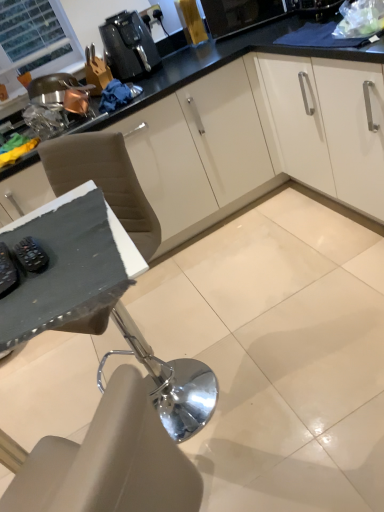
Question: Is black plastic coffee machine at upper center oriented towards black rubber remote control at lower left, the first appliance viewed from the left?

Choices:
 (A) no
 (B) yes

Answer: (A)

Question: Is black plastic coffee machine at upper center closer to the viewer compared to black rubber remote control at lower left, the first appliance viewed from the left?

Choices:
 (A) yes
 (B) no

Answer: (B)

Question: From the image's perspective, would you say black plastic coffee machine at upper center is shown under black rubber remote control at lower left, which appears as the 2th appliance when viewed from the right?

Choices:
 (A) no
 (B) yes

Answer: (A)

Question: From a real-world perspective, does black plastic coffee machine at upper center stand above black rubber remote control at lower left, the first appliance viewed from the left?

Choices:
 (A) no
 (B) yes

Answer: (B)

Question: Is black plastic coffee machine at upper center shorter than black rubber remote control at lower left, the first appliance viewed from the left?

Choices:
 (A) yes
 (B) no

Answer: (B)

Question: Considering the positions of point (11, 276) and point (119, 38), is point (11, 276) closer or farther from the camera than point (119, 38)?

Choices:
 (A) farther
 (B) closer

Answer: (B)

Question: From the image's perspective, is black rubber remote control at lower left, the first appliance viewed from the left, above or below black plastic coffee machine at upper center?

Choices:
 (A) above
 (B) below

Answer: (B)

Question: Is black rubber remote control at lower left, the first appliance viewed from the left, wider or thinner than black plastic coffee machine at upper center?

Choices:
 (A) thin
 (B) wide

Answer: (A)

Question: Is black rubber remote control at lower left, the first appliance viewed from the left, inside or outside of black plastic coffee machine at upper center?

Choices:
 (A) inside
 (B) outside

Answer: (B)

Question: Is point (137, 38) closer or farther from the camera than point (36, 268)?

Choices:
 (A) closer
 (B) farther

Answer: (B)

Question: From the image's perspective, is black plastic coffee machine at upper center located above or below black rubber remote control at left, which is the 1th appliance from right to left?

Choices:
 (A) above
 (B) below

Answer: (A)

Question: Based on their positions, is black plastic coffee machine at upper center located to the left or right of black rubber remote control at left, which is the 1th appliance from right to left?

Choices:
 (A) right
 (B) left

Answer: (B)

Question: Considering their positions, is black plastic coffee machine at upper center located in front of or behind black rubber remote control at left, which is the 1th appliance from right to left?

Choices:
 (A) behind
 (B) front

Answer: (A)

Question: From the image's perspective, is black plastic coffee machine at upper center above or below black rubber remote control at lower left, the first appliance viewed from the left?

Choices:
 (A) above
 (B) below

Answer: (A)

Question: In terms of height, does black plastic coffee machine at upper center look taller or shorter compared to black rubber remote control at lower left, which appears as the 2th appliance when viewed from the right?

Choices:
 (A) tall
 (B) short

Answer: (A)